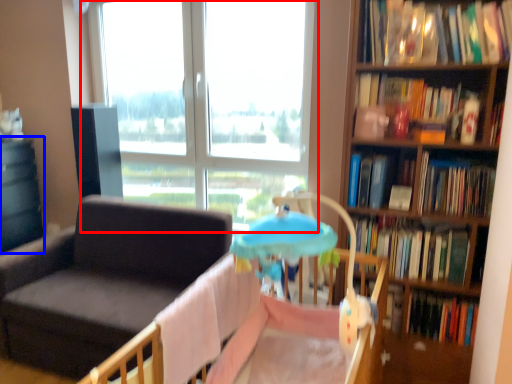
Question: Among these objects, which one is farthest to the camera, window (highlighted by a red box) or table (highlighted by a blue box)?

Choices:
 (A) window
 (B) table

Answer: (B)